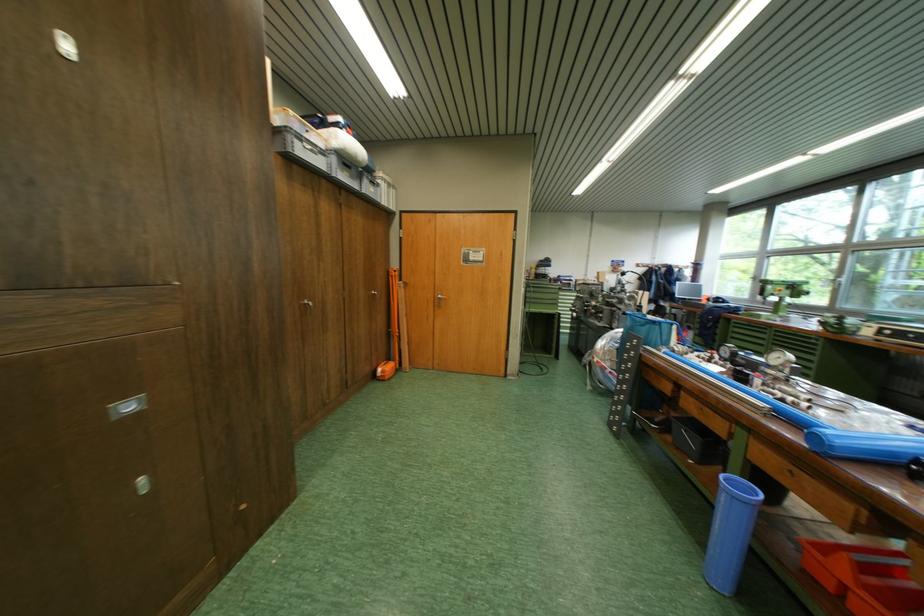
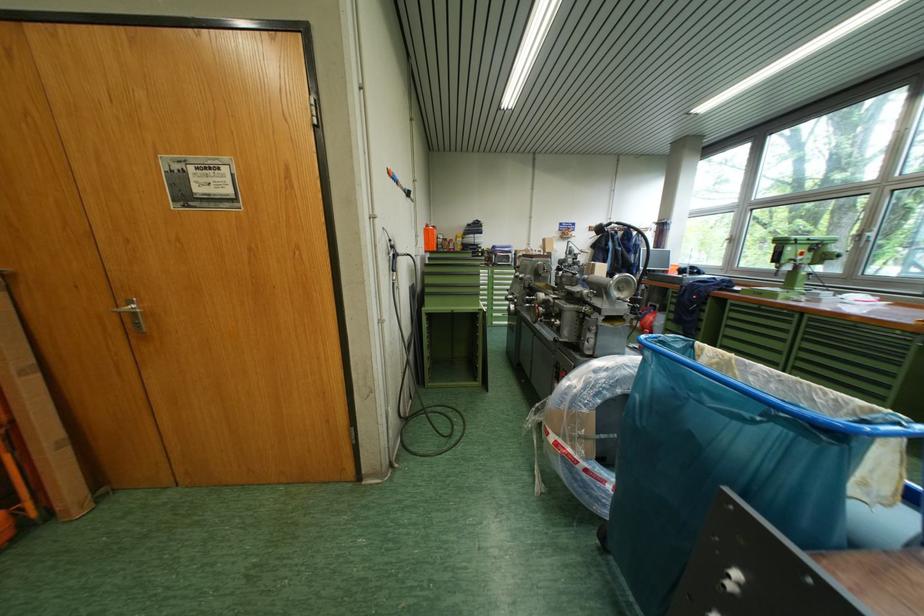
Where in the second image is the point corresponding to (x=446, y=297) from the first image?

(131, 305)